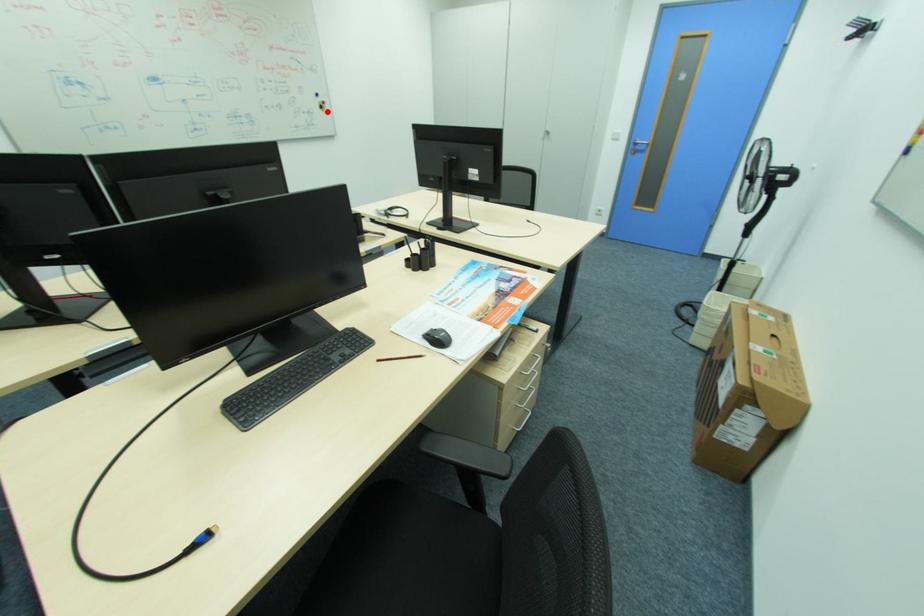
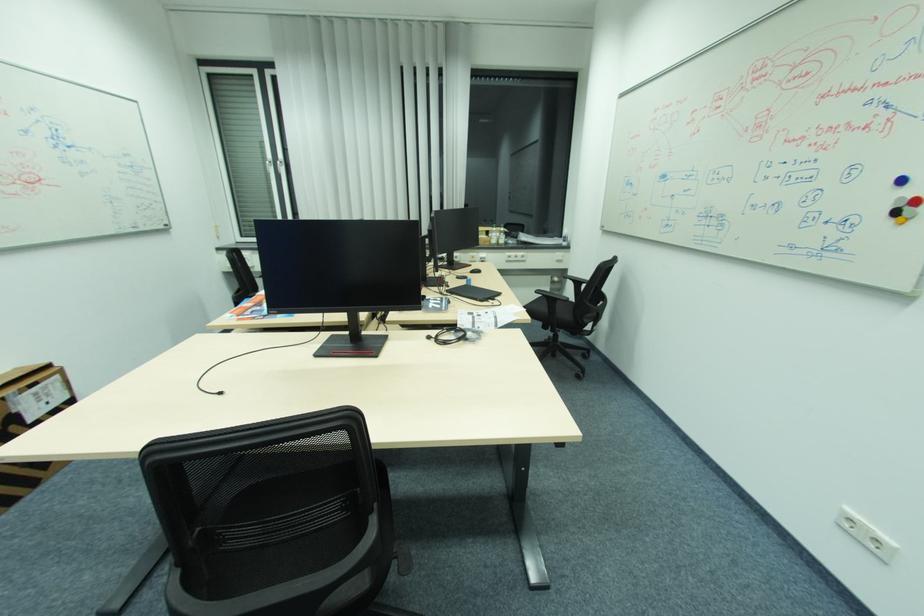
Question: A red point is marked in image1. In image2, is the corresponding 3D point closer to the camera or farther? Reply with the corresponding letter.

Choices:
 (A) The corresponding 3D point is closer.
 (B) The corresponding 3D point is farther.

Answer: (B)